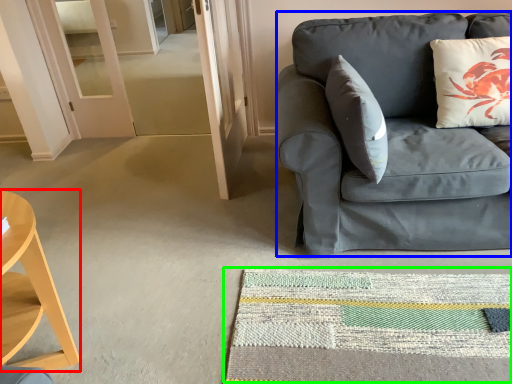
Question: Which object is positioned farthest from desk (highlighted by a red box)? Select from studio couch (highlighted by a blue box) and mat (highlighted by a green box).

Choices:
 (A) studio couch
 (B) mat

Answer: (A)